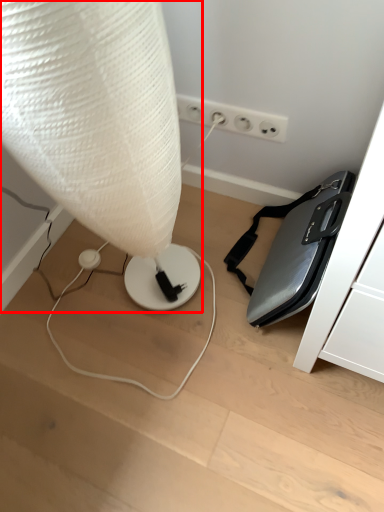
Question: Where is lamp (annotated by the red box) located in relation to electric outlet in the image?

Choices:
 (A) right
 (B) left

Answer: (B)